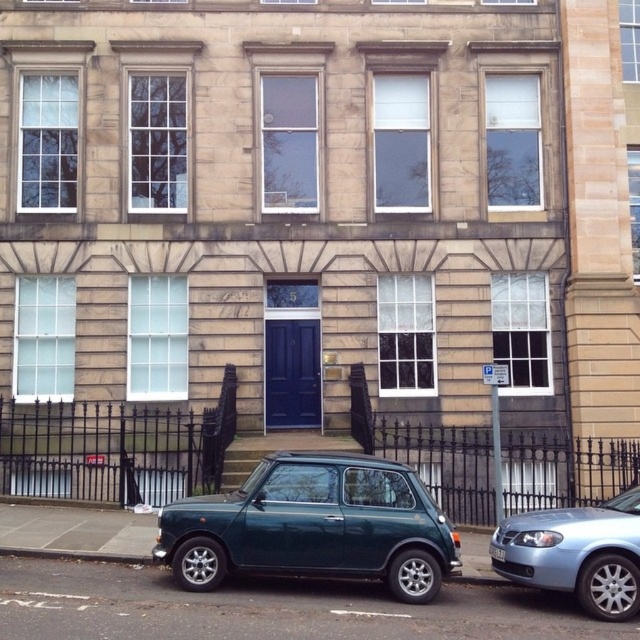
Who is positioned more to the right, light blue metallic sedan at lower right or white plastic license plate at center?

light blue metallic sedan at lower right is more to the right.

Who is shorter, light blue metallic sedan at lower right or white plastic license plate at center?

Answer: With less height is white plastic license plate at center.

Where is `light blue metallic sedan at lower right`? The image size is (640, 640). light blue metallic sedan at lower right is located at coordinates (577, 554).

Locate an element on the screen. matte dark blue door at center is located at coordinates (291, 372).

Can you confirm if matte dark blue door at center is bigger than white plastic license plate at center?

Indeed, matte dark blue door at center has a larger size compared to white plastic license plate at center.

Image resolution: width=640 pixels, height=640 pixels. I want to click on matte dark blue door at center, so click(291, 372).

Which is behind, point (392, 470) or point (314, 387)?

Point (314, 387)

Between teal glossy hatchback at lower center and matte dark blue door at center, which one appears on the right side from the viewer's perspective?

From the viewer's perspective, teal glossy hatchback at lower center appears more on the right side.

Identify the location of teal glossy hatchback at lower center. Image resolution: width=640 pixels, height=640 pixels. (314, 525).